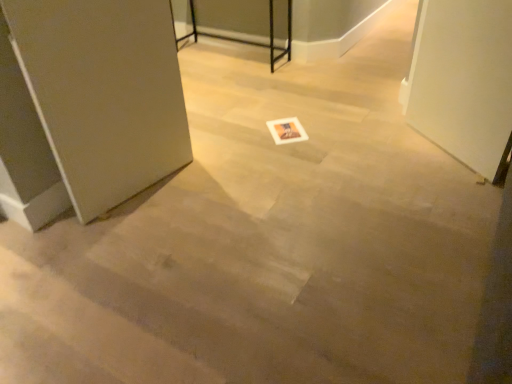
What do you see at coordinates (287, 130) in the screenshot? The height and width of the screenshot is (384, 512). I see `white paper postcard at center` at bounding box center [287, 130].

What do you see at coordinates (88, 105) in the screenshot? I see `satin silver door at left` at bounding box center [88, 105].

Locate an element on the screen. This screenshot has height=384, width=512. satin silver door at left is located at coordinates (88, 105).

This screenshot has width=512, height=384. What do you see at coordinates (247, 40) in the screenshot?
I see `metallic black table at upper center` at bounding box center [247, 40].

At what (x,y) coordinates should I click in order to perform the action: click on white glossy screen door at right. Please return your answer as a coordinate pair (x, y). This screenshot has width=512, height=384. Looking at the image, I should click on (464, 81).

Are white paper postcard at center and white glossy screen door at right located far from each other?

No, white paper postcard at center is not far away from white glossy screen door at right.

Considering the relative sizes of white paper postcard at center and white glossy screen door at right in the image provided, is white paper postcard at center wider than white glossy screen door at right?

Yes.

Considering the positions of point (283, 126) and point (480, 7), is point (283, 126) closer or farther from the camera than point (480, 7)?

Point (283, 126) is positioned farther from the camera compared to point (480, 7).

Find the location of a particular element. This screenshot has width=512, height=384. postcard below the white glossy screen door at right (from a real-world perspective) is located at coordinates (287, 130).

Does white glossy screen door at right appear on the left side of satin silver door at left?

No, white glossy screen door at right is not to the left of satin silver door at left.

How many degrees apart are the facing directions of white glossy screen door at right and satin silver door at left?

The facing directions of white glossy screen door at right and satin silver door at left are 118 degrees apart.

Considering the sizes of white glossy screen door at right and satin silver door at left in the image, is white glossy screen door at right taller or shorter than satin silver door at left?

Considering their sizes, white glossy screen door at right has less height than satin silver door at left.

Is satin silver door at left at the back of white glossy screen door at right?

No, white glossy screen door at right is not facing away from satin silver door at left.

Is satin silver door at left far away from metallic black table at upper center?

Yes, satin silver door at left and metallic black table at upper center are quite far apart.

Does satin silver door at left have a lesser height compared to metallic black table at upper center?

In fact, satin silver door at left may be taller than metallic black table at upper center.

Is satin silver door at left at the right side of metallic black table at upper center?

No, satin silver door at left is not to the right of metallic black table at upper center.

Consider the image. How many degrees apart are the facing directions of satin silver door at left and metallic black table at upper center?

79.4 degrees separate the facing orientations of satin silver door at left and metallic black table at upper center.

How far apart are metallic black table at upper center and white paper postcard at center?

metallic black table at upper center is 3.66 feet away from white paper postcard at center.

Could you tell me if metallic black table at upper center is facing white paper postcard at center?

No, metallic black table at upper center is not aimed at white paper postcard at center.

Is white paper postcard at center a part of metallic black table at upper center?

Actually, white paper postcard at center is outside metallic black table at upper center.

From a real-world perspective, between metallic black table at upper center and white paper postcard at center, who is vertically higher?

From a 3D spatial view, metallic black table at upper center is above.

From a real-world perspective, is metallic black table at upper center under white glossy screen door at right?

Indeed, from a real-world perspective, metallic black table at upper center is positioned beneath white glossy screen door at right.

Locate an element on the screen. This screenshot has width=512, height=384. table on the left side of white glossy screen door at right is located at coordinates (247, 40).

Is metallic black table at upper center at the left side of white glossy screen door at right?

Indeed, metallic black table at upper center is positioned on the left side of white glossy screen door at right.

Could you tell me if metallic black table at upper center is facing white glossy screen door at right?

No, metallic black table at upper center is not facing towards white glossy screen door at right.

Is white paper postcard at center oriented away from satin silver door at left?

No, white paper postcard at center is not facing away from satin silver door at left.

Is white paper postcard at center wider or thinner than satin silver door at left?

In the image, white paper postcard at center appears to be wider than satin silver door at left.

Does point (296, 139) come closer to viewer compared to point (104, 118)?

No, (296, 139) is behind (104, 118).

Is white paper postcard at center not near satin silver door at left?

Indeed, white paper postcard at center is not near satin silver door at left.

Considering the relative sizes of satin silver door at left and white paper postcard at center in the image provided, is satin silver door at left thinner than white paper postcard at center?

Yes, satin silver door at left is thinner than white paper postcard at center.

Considering the sizes of objects satin silver door at left and white paper postcard at center in the image provided, who is shorter, satin silver door at left or white paper postcard at center?

white paper postcard at center.

Is satin silver door at left surrounding white paper postcard at center?

No, white paper postcard at center is located outside of satin silver door at left.

Identify the location of postcard that appears on the right of satin silver door at left. The height and width of the screenshot is (384, 512). (287, 130).

I want to click on screen door to the right of white paper postcard at center, so click(x=464, y=81).

At what (x,y) coordinates should I click in order to perform the action: click on screen door lying above the satin silver door at left (from the image's perspective). Please return your answer as a coordinate pair (x, y). The image size is (512, 384). Looking at the image, I should click on (464, 81).

Considering their positions, is white glossy screen door at right positioned further to satin silver door at left than white paper postcard at center?

The object further to satin silver door at left is white glossy screen door at right.

Estimate the real-world distances between objects in this image. Which object is further from metallic black table at upper center, white paper postcard at center or white glossy screen door at right?

white glossy screen door at right is positioned further to the anchor metallic black table at upper center.

Estimate the real-world distances between objects in this image. Which object is further from white paper postcard at center, satin silver door at left or metallic black table at upper center?

metallic black table at upper center is positioned further to the anchor white paper postcard at center.

Estimate the real-world distances between objects in this image. Which object is closer to metallic black table at upper center, white glossy screen door at right or white paper postcard at center?

white paper postcard at center is closer to metallic black table at upper center.

Considering their positions, is metallic black table at upper center positioned closer to white paper postcard at center than white glossy screen door at right?

Among the two, white glossy screen door at right is located nearer to white paper postcard at center.

Looking at the image, which one is located further to white glossy screen door at right, white paper postcard at center or metallic black table at upper center?

Among the two, metallic black table at upper center is located further to white glossy screen door at right.

From the image, which object appears to be nearer to metallic black table at upper center, satin silver door at left or white glossy screen door at right?

white glossy screen door at right.

Estimate the real-world distances between objects in this image. Which object is further from metallic black table at upper center, white glossy screen door at right or satin silver door at left?

Based on the image, satin silver door at left appears to be further to metallic black table at upper center.

This screenshot has height=384, width=512. I want to click on postcard located between white glossy screen door at right and metallic black table at upper center in the depth direction, so click(287, 130).

Find the location of a particular element. The height and width of the screenshot is (384, 512). postcard between satin silver door at left and metallic black table at upper center from front to back is located at coordinates (287, 130).

Identify the location of postcard between satin silver door at left and white glossy screen door at right from left to right. This screenshot has width=512, height=384. (287, 130).

Locate an element on the screen. This screenshot has width=512, height=384. table between satin silver door at left and white glossy screen door at right from left to right is located at coordinates (247, 40).